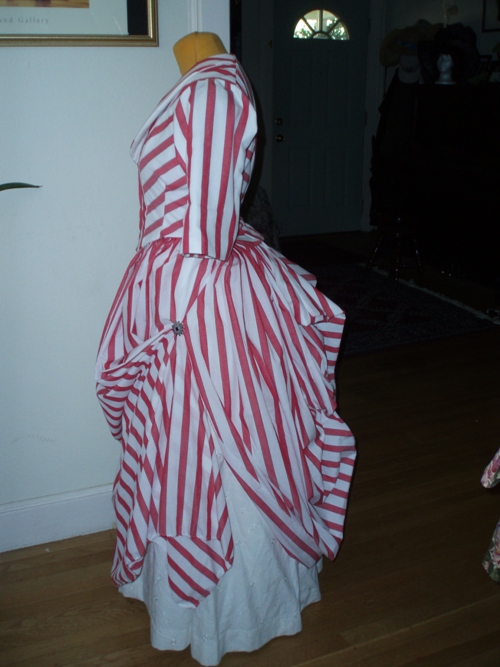
Image resolution: width=500 pixels, height=667 pixels. Find the location of `baseboard`. baseboard is located at coordinates (64, 511).